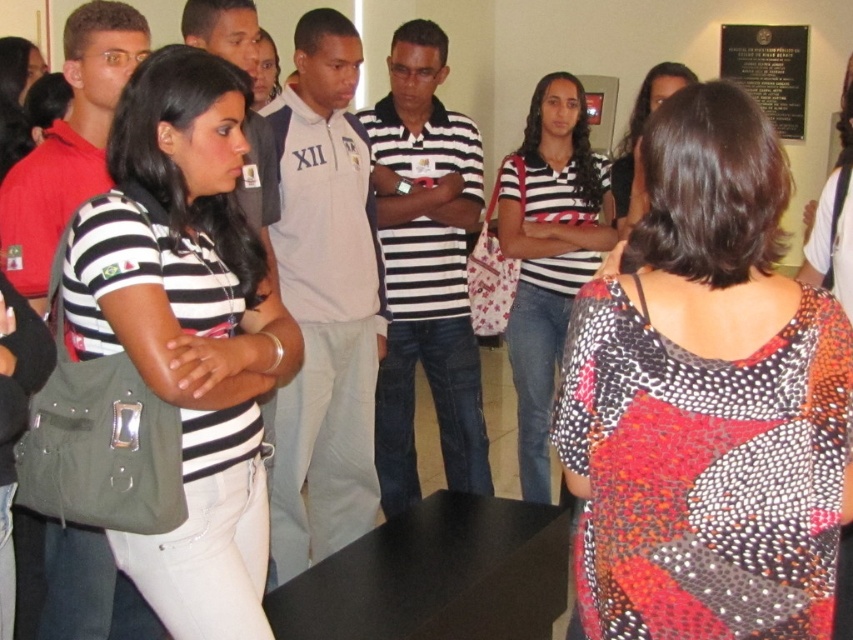
Based on the photo, based on the scene description, which object takes up more area in the image? Please choose between the matte black shirt at center and the black polished stone plaque at upper right.

The black polished stone plaque at upper right occupies more area than the matte black shirt at center according to the description.

You are standing in the conference room and need to locate the matte black shirt at center and the black polished stone plaque at upper right. From your perspective, which object is positioned to the left?

The matte black shirt at center is positioned to the left of the black polished stone plaque at upper right.